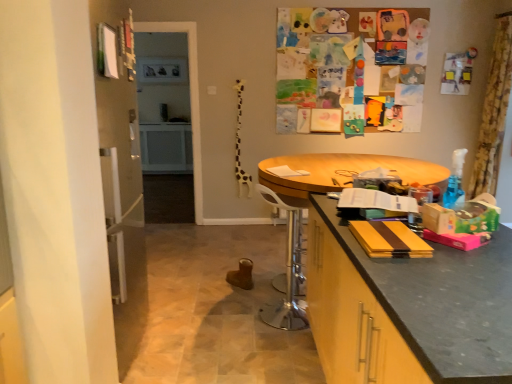
I want to click on white plastic swivel chair at center, so (x=286, y=272).

Measure the distance between point (300, 248) and camera.

Point (300, 248) is 9.05 feet away from camera.

Describe the element at coordinates (341, 172) in the screenshot. I see `wooden round table at center` at that location.

Find the location of a particular element. This screenshot has height=384, width=512. white plastic swivel chair at center is located at coordinates (286, 272).

Is matte black countertop at right in contact with white plastic swivel chair at center?

No, matte black countertop at right is not in contact with white plastic swivel chair at center.

Is matte black countertop at right positioned beyond the bounds of white plastic swivel chair at center?

Absolutely, matte black countertop at right is external to white plastic swivel chair at center.

How many degrees apart are the facing directions of matte black countertop at right and white plastic swivel chair at center?

21.2 degrees.

Which is more to the left, matte black countertop at right or white plastic swivel chair at center?

From the viewer's perspective, white plastic swivel chair at center appears more on the left side.

Do you think yellow floral fabric curtain at upper right is within matte black countertop at right, or outside of it?

The correct answer is: outside.

Is yellow floral fabric curtain at upper right smaller than matte black countertop at right?

Correct, yellow floral fabric curtain at upper right occupies less space than matte black countertop at right.

Is yellow floral fabric curtain at upper right looking in the opposite direction of matte black countertop at right?

No, matte black countertop at right is not at the back of yellow floral fabric curtain at upper right.

Based on the photo, from the image's perspective, is yellow floral fabric curtain at upper right above or below matte black countertop at right?

Based on their image positions, yellow floral fabric curtain at upper right is located above matte black countertop at right.

What's the angular difference between yellow floral fabric curtain at upper right and wooden round table at center's facing directions?

They differ by 88.7 degrees in their facing directions.

Is yellow floral fabric curtain at upper right far from wooden round table at center?

Absolutely, yellow floral fabric curtain at upper right is distant from wooden round table at center.

Is yellow floral fabric curtain at upper right bigger or smaller than wooden round table at center?

yellow floral fabric curtain at upper right is smaller than wooden round table at center.

Is yellow floral fabric curtain at upper right not within wooden round table at center?

Yes, yellow floral fabric curtain at upper right is outside of wooden round table at center.

Is wooden round table at center smaller than yellow floral fabric curtain at upper right?

Incorrect, wooden round table at center is not smaller in size than yellow floral fabric curtain at upper right.

From the image's perspective, is wooden round table at center under yellow floral fabric curtain at upper right?

Correct, wooden round table at center appears lower than yellow floral fabric curtain at upper right in the image.

Which is in front, wooden round table at center or yellow floral fabric curtain at upper right?

wooden round table at center is in front.

Considering the relative sizes of white plastic swivel chair at center and matte black countertop at right in the image provided, is white plastic swivel chair at center taller than matte black countertop at right?

No.

From the image's perspective, between white plastic swivel chair at center and matte black countertop at right, who is located below?

From the image's view, matte black countertop at right is below.

Is white plastic swivel chair at center oriented away from matte black countertop at right?

white plastic swivel chair at center does not have its back to matte black countertop at right.

Based on their sizes in the image, would you say white plastic swivel chair at center is bigger or smaller than matte black countertop at right?

Clearly, white plastic swivel chair at center is smaller in size than matte black countertop at right.

Between wooden round table at center and white plastic swivel chair at center, which one has larger size?

Bigger between the two is wooden round table at center.

Is wooden round table at center in contact with white plastic swivel chair at center?

No, wooden round table at center is not with white plastic swivel chair at center.

Can white plastic swivel chair at center be found inside wooden round table at center?

Indeed, white plastic swivel chair at center is located within wooden round table at center.

Is wooden round table at center oriented away from white plastic swivel chair at center?

wooden round table at center does not have its back to white plastic swivel chair at center.

What's the angular difference between matte black countertop at right and yellow floral fabric curtain at upper right's facing directions?

They differ by 179 degrees in their facing directions.

Does point (439, 275) come in front of point (498, 154)?

Yes, point (439, 275) is closer to viewer.

Is there a large distance between matte black countertop at right and yellow floral fabric curtain at upper right?

Yes.

Locate an element on the screen. Image resolution: width=512 pixels, height=384 pixels. cabinetry below the white plastic swivel chair at center (from the image's perspective) is located at coordinates (408, 309).

The height and width of the screenshot is (384, 512). There is a matte black countertop at right. In order to click on curtain above it (from a real-world perspective) in this screenshot , I will do `click(493, 111)`.

Estimate the real-world distances between objects in this image. Which object is closer to matte black countertop at right, yellow floral fabric curtain at upper right or white plastic swivel chair at center?

The object closer to matte black countertop at right is white plastic swivel chair at center.

From the image, which object appears to be farther from matte black countertop at right, white plastic swivel chair at center or yellow floral fabric curtain at upper right?

Based on the image, yellow floral fabric curtain at upper right appears to be further to matte black countertop at right.

Considering their positions, is yellow floral fabric curtain at upper right positioned further to white plastic swivel chair at center than wooden round table at center?

Among the two, yellow floral fabric curtain at upper right is located further to white plastic swivel chair at center.

Based on the photo, based on their spatial positions, is wooden round table at center or matte black countertop at right further from white plastic swivel chair at center?

matte black countertop at right lies further to white plastic swivel chair at center than the other object.

Which object lies nearer to the anchor point matte black countertop at right, wooden round table at center or yellow floral fabric curtain at upper right?

Among the two, wooden round table at center is located nearer to matte black countertop at right.

When comparing their distances from wooden round table at center, does white plastic swivel chair at center or matte black countertop at right seem closer?

The object closer to wooden round table at center is white plastic swivel chair at center.

Which object lies nearer to the anchor point white plastic swivel chair at center, wooden round table at center or yellow floral fabric curtain at upper right?

wooden round table at center is positioned closer to the anchor white plastic swivel chair at center.

Considering their positions, is wooden round table at center positioned closer to matte black countertop at right than white plastic swivel chair at center?

The object closer to matte black countertop at right is wooden round table at center.

The width and height of the screenshot is (512, 384). Identify the location of round table between matte black countertop at right and yellow floral fabric curtain at upper right along the z-axis. (341, 172).

Locate an element on the screen. round table between white plastic swivel chair at center and yellow floral fabric curtain at upper right is located at coordinates 341,172.

The width and height of the screenshot is (512, 384). I want to click on swivel chair between matte black countertop at right and yellow floral fabric curtain at upper right along the z-axis, so click(286, 272).

The width and height of the screenshot is (512, 384). I want to click on round table between matte black countertop at right and white plastic swivel chair at center in the front-back direction, so click(x=341, y=172).